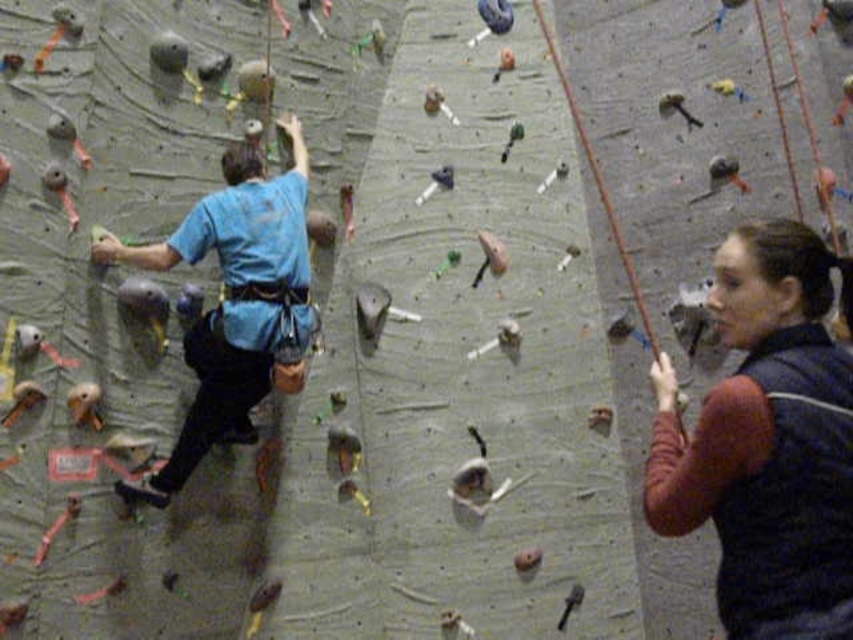
Does dark blue fleece vest at right come in front of blue fabric shirt at center?

Yes, it is in front of blue fabric shirt at center.

Identify the location of dark blue fleece vest at right. (767, 442).